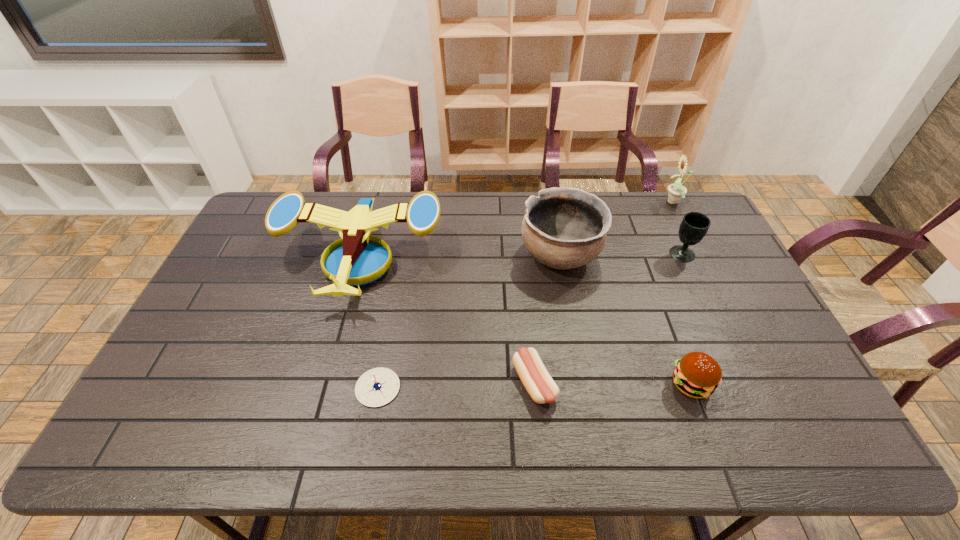
Image resolution: width=960 pixels, height=540 pixels. What are the coordinates of `vacant region located on the front-facing side of the farthest object` in the screenshot? It's located at (583, 203).

In order to click on free location located 0.370m on the front of the pottery in this screenshot , I will do `click(585, 393)`.

Where is `free space located 0.130m at the cockpit of the drone`? Image resolution: width=960 pixels, height=540 pixels. free space located 0.130m at the cockpit of the drone is located at coordinates (333, 353).

You are a GUI agent. You are given a task and a screenshot of the screen. Output one action in this format:
    pyautogui.click(x=<x>, y=<y>)
    Task: Click on the free space located 0.160m on the back of the chalice
    Image resolution: width=960 pixels, height=540 pixels.
    Given the screenshot: What is the action you would take?
    pyautogui.click(x=664, y=217)

You are a GUI agent. You are given a task and a screenshot of the screen. Output one action in this format:
    pyautogui.click(x=<x>, y=<y>)
    Task: Click on the free space located 0.160m on the right of the third shortest object
    
    Given the screenshot: What is the action you would take?
    pyautogui.click(x=775, y=384)

The height and width of the screenshot is (540, 960). What are the coordinates of `free spot located 0.190m on the back of the compass` in the screenshot? It's located at (392, 313).

Find the location of `blank space located on the right of the sausage`. blank space located on the right of the sausage is located at coordinates (579, 383).

Where is `sunflower present at the far edge`? This screenshot has width=960, height=540. sunflower present at the far edge is located at coordinates (676, 191).

The image size is (960, 540). What are the coordinates of `pottery that is at the far edge` in the screenshot? It's located at pyautogui.click(x=563, y=228).

At what (x,y) coordinates should I click in order to perform the action: click on drone situated at the far edge. Please return your answer as a coordinate pair (x, y). Looking at the image, I should click on (357, 260).